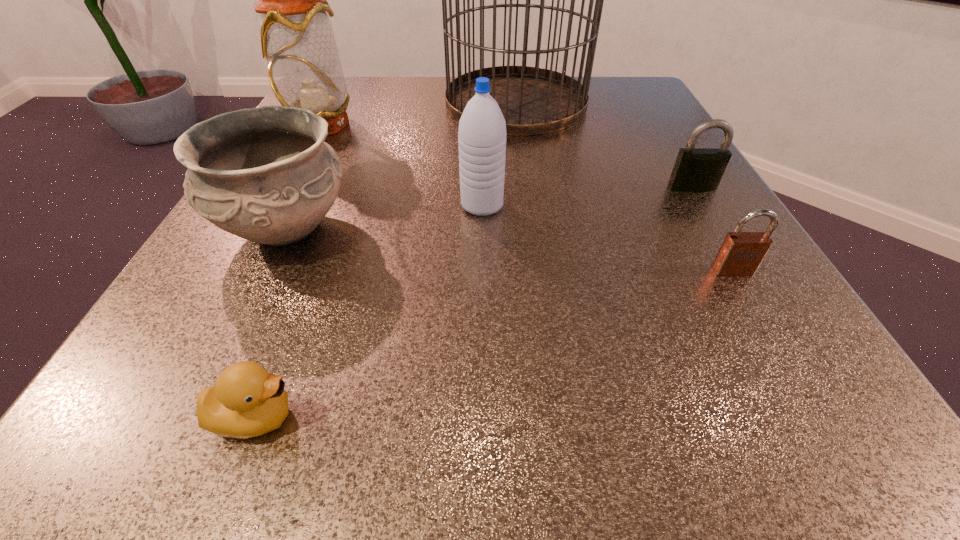
In the image, there is a desktop. Identify the location of free region at the right edge. The height and width of the screenshot is (540, 960). (713, 237).

In the image, there is a desktop. Find the location of `free space at the far left corner`. free space at the far left corner is located at coordinates (366, 80).

Identify the location of vacant space at the near left corner. Image resolution: width=960 pixels, height=540 pixels. (120, 437).

Find the location of a particular element. The height and width of the screenshot is (540, 960). free location at the far right corner is located at coordinates [x=611, y=106].

Find the location of a particular element. Image resolution: width=960 pixels, height=540 pixels. empty space between the duckling and the farther padlock is located at coordinates point(474,302).

The height and width of the screenshot is (540, 960). I want to click on empty space between the water bottle and the oil lamp, so click(401, 165).

Locate an element on the screen. vacant space in between the third tallest object and the nearer padlock is located at coordinates (608, 238).

I want to click on vacant area that lies between the shortest object and the water bottle, so (369, 311).

Find the location of a particular element. Image resolution: width=960 pixels, height=540 pixels. free spot between the second shortest object and the duckling is located at coordinates (494, 343).

This screenshot has height=540, width=960. Identify the location of vacant region between the birdcage and the shortest object. (386, 260).